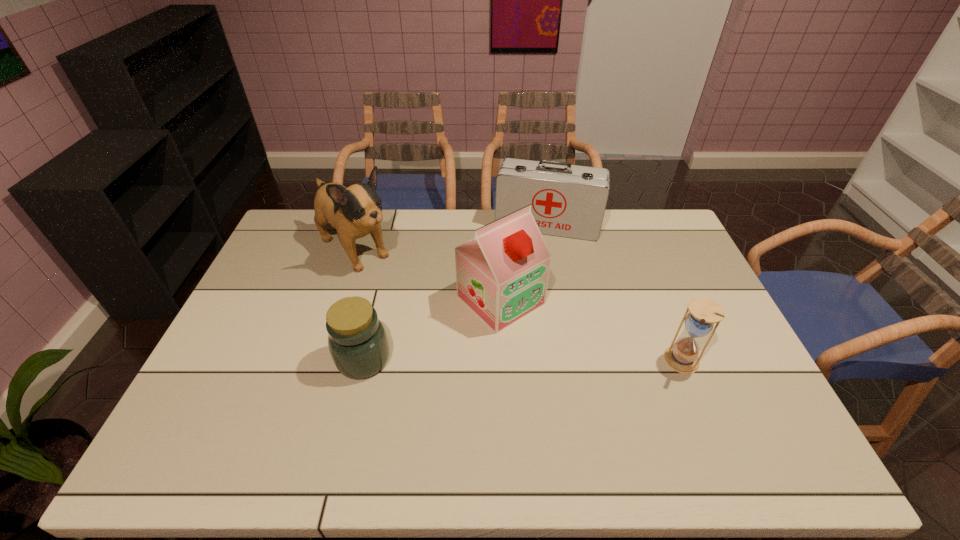
Find the location of a particular element. free space located 0.350m on the front-facing side of the first-aid kit is located at coordinates (523, 312).

Locate an element on the screen. This screenshot has width=960, height=540. free space located 0.150m on the front-facing side of the first-aid kit is located at coordinates (532, 269).

The image size is (960, 540). In order to click on vacant space situated on the front-facing side of the first-aid kit in this screenshot , I will do `click(535, 259)`.

What are the coordinates of `vacant position located 0.120m with the cap open on the soya milk` in the screenshot? It's located at (560, 353).

Image resolution: width=960 pixels, height=540 pixels. Find the location of `vacant space positioned with the cap open on the soya milk`. vacant space positioned with the cap open on the soya milk is located at coordinates (628, 412).

The width and height of the screenshot is (960, 540). In order to click on vacant space located 0.090m with the cap open on the soya milk in this screenshot , I will do `click(552, 346)`.

Locate an element on the screen. puppy situated at the far edge is located at coordinates (356, 211).

At what (x,y) coordinates should I click in order to perform the action: click on the first-aid kit located in the far edge section of the desktop. Please return your answer as a coordinate pair (x, y). The width and height of the screenshot is (960, 540). Looking at the image, I should click on (566, 200).

At what (x,y) coordinates should I click in order to perform the action: click on object present at the left edge. Please return your answer as a coordinate pair (x, y). The width and height of the screenshot is (960, 540). Looking at the image, I should click on (356, 211).

The height and width of the screenshot is (540, 960). Find the location of `object that is at the right edge`. object that is at the right edge is located at coordinates pyautogui.click(x=682, y=357).